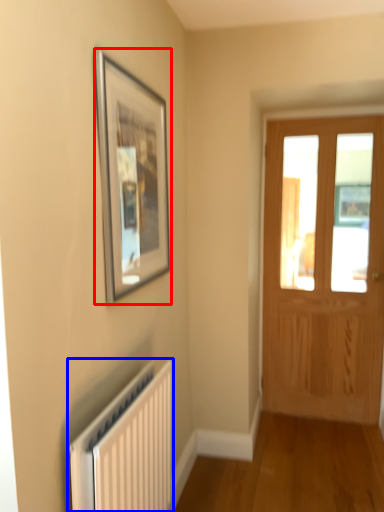
Question: Which point is closer to the camera, picture frame (highlighted by a red box) or radiator (highlighted by a blue box)?

Choices:
 (A) picture frame
 (B) radiator

Answer: (B)